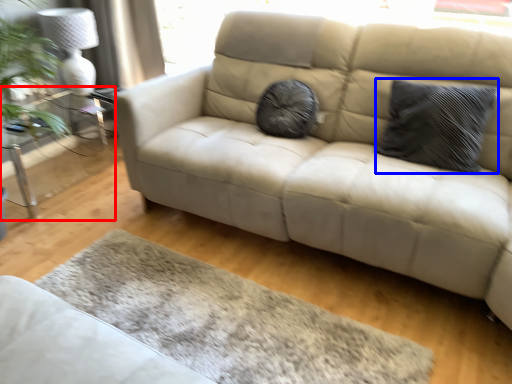
Question: Which point is further to the camera, table (highlighted by a red box) or pillow (highlighted by a blue box)?

Choices:
 (A) table
 (B) pillow

Answer: (A)